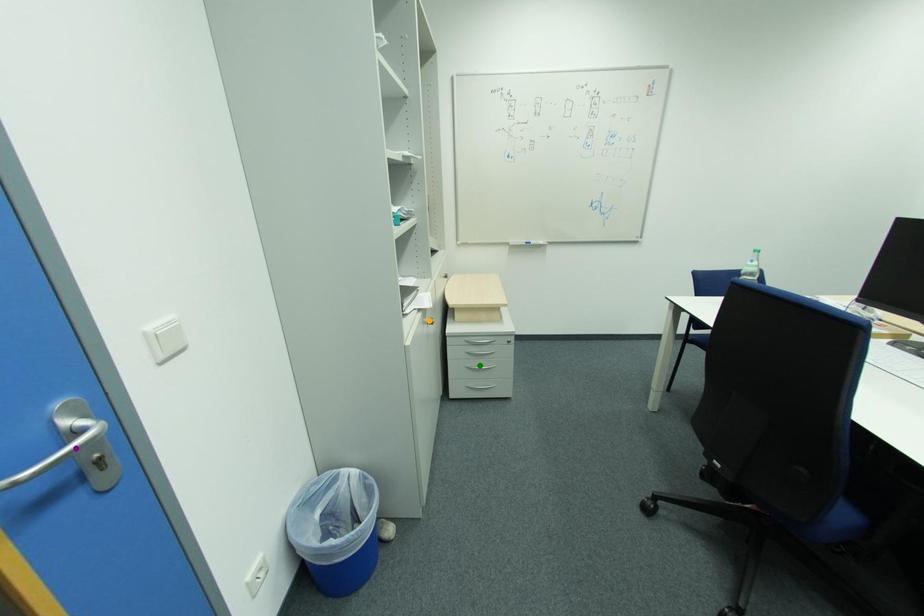
Order these from nearest to farthest:
A) green point
B) orange point
C) purple point

purple point < orange point < green point